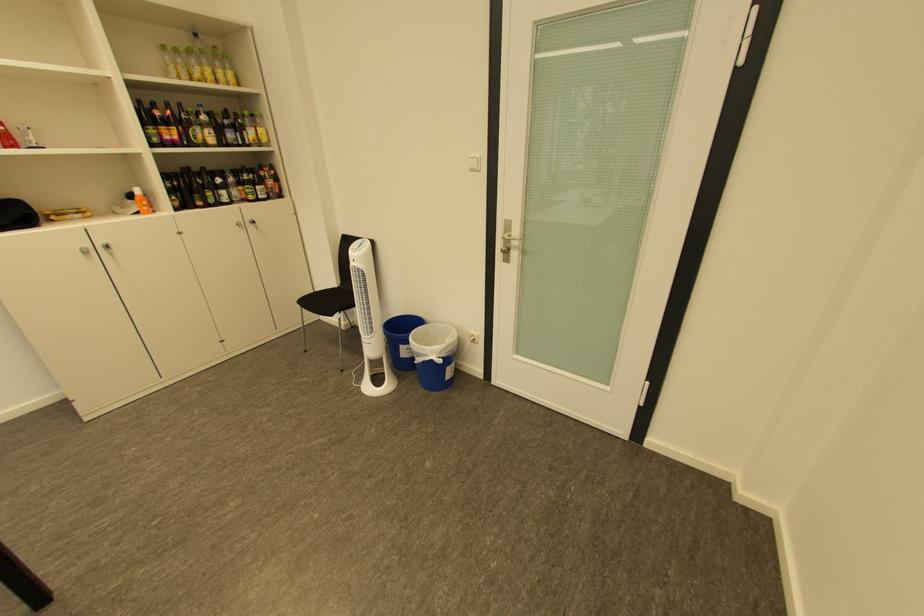
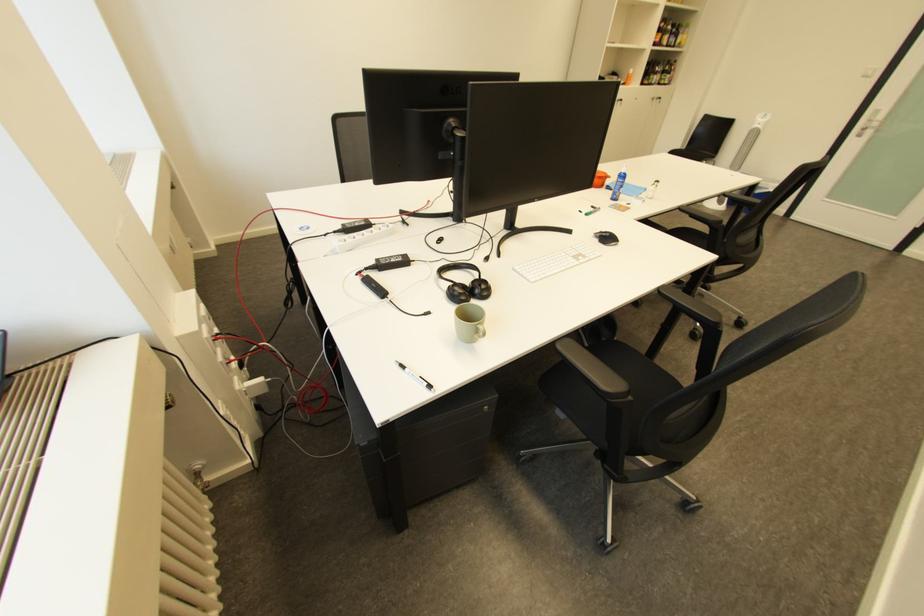
In a continuous first-person perspective shot, in which direction is the camera moving?

The cameraman walked toward left, backward.